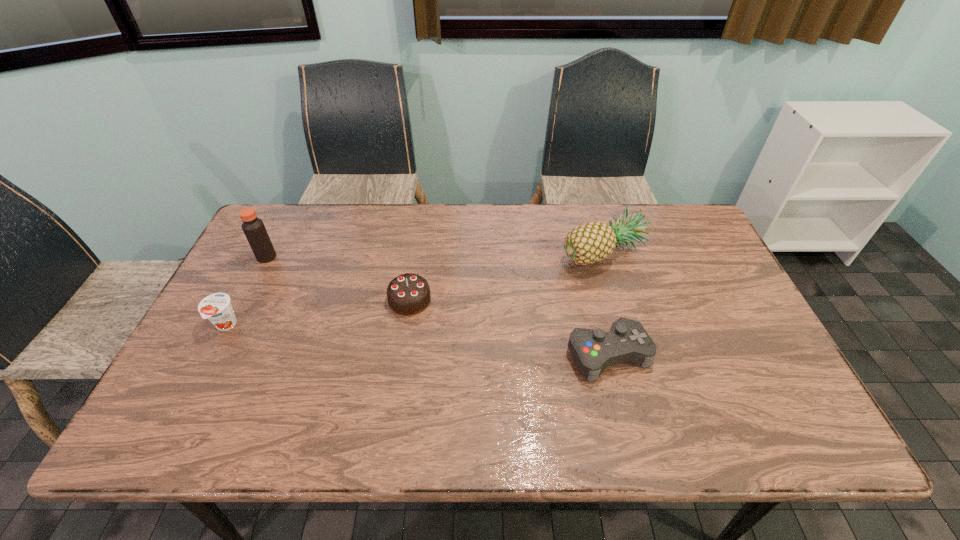
The height and width of the screenshot is (540, 960). Find the location of `free space between the tallest object and the third object from left to right`. free space between the tallest object and the third object from left to right is located at coordinates (338, 279).

You are a GUI agent. You are given a task and a screenshot of the screen. Output one action in this format:
    pyautogui.click(x=<x>, y=<y>)
    Task: Click on the unoccupied area between the vinegar and the fourth shortest object
    This screenshot has width=960, height=540.
    Given the screenshot: What is the action you would take?
    pyautogui.click(x=435, y=255)

Locate an element on the screen. vacant space that's between the control and the pineapple is located at coordinates click(x=606, y=303).

In order to click on free space between the chocolate cake and the control in this screenshot , I will do `click(509, 327)`.

The image size is (960, 540). What are the coordinates of `free point between the vinegar and the fourth shortest object` in the screenshot? It's located at (435, 255).

Locate an element on the screen. The image size is (960, 540). blank region between the yogurt and the vinegar is located at coordinates click(x=247, y=292).

In order to click on free space between the vinegar and the control in this screenshot , I will do `click(438, 306)`.

The height and width of the screenshot is (540, 960). Find the location of `object that is the fourth nearest to the yogurt`. object that is the fourth nearest to the yogurt is located at coordinates (591, 242).

Choose which object is the second nearest neighbor to the fourth shortest object. Please provide its 2D coordinates. Your answer should be formatted as a tuple, i.e. [(x, y)], where the tuple contains the x and y coordinates of a point satisfying the conditions above.

[(408, 294)]

At what (x,y) coordinates should I click in order to perform the action: click on vacant region that satisfies the following two spatial constraints: 1. on the front side of the tallest object; 2. on the right side of the chocolate cake. Please return your answer as a coordinate pair (x, y). The height and width of the screenshot is (540, 960). Looking at the image, I should click on (245, 300).